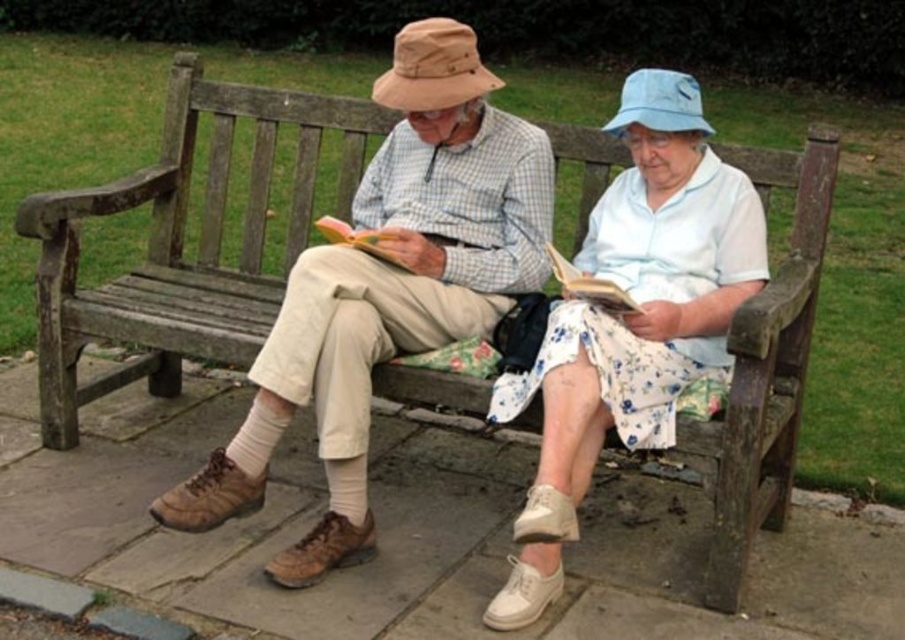
Question: Is brown leather shoes at center below hardcover book at center?

Choices:
 (A) yes
 (B) no

Answer: (A)

Question: Can you confirm if white floral skirt at center is bigger than hardcover book at center?

Choices:
 (A) yes
 (B) no

Answer: (A)

Question: Estimate the real-world distances between objects in this image. Which object is farther from the hardcover book at center?

Choices:
 (A) white floral skirt at center
 (B) brown leather shoes at center

Answer: (B)

Question: Which object is farther from the camera taking this photo?

Choices:
 (A) white floral skirt at center
 (B) brown leather shoes at center
 (C) hardcover book at center

Answer: (B)

Question: Among these points, which one is farthest from the camera?

Choices:
 (A) (618, 301)
 (B) (492, 420)
 (C) (268, 365)

Answer: (B)

Question: Does brown leather shoes at center appear on the left side of hardcover book at center?

Choices:
 (A) no
 (B) yes

Answer: (B)